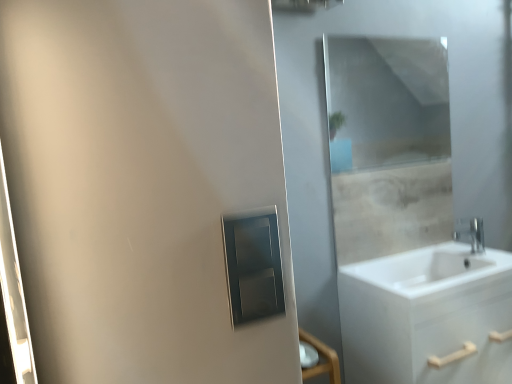
Question: Does silver metallic faucet at right have a larger size compared to matte silver medicine cabinet at center?

Choices:
 (A) yes
 (B) no

Answer: (A)

Question: From a real-world perspective, is silver metallic faucet at right positioned over matte silver medicine cabinet at center based on gravity?

Choices:
 (A) no
 (B) yes

Answer: (A)

Question: Does silver metallic faucet at right have a lesser width compared to matte silver medicine cabinet at center?

Choices:
 (A) yes
 (B) no

Answer: (B)

Question: From a real-world perspective, is silver metallic faucet at right beneath matte silver medicine cabinet at center?

Choices:
 (A) yes
 (B) no

Answer: (A)

Question: Considering the relative sizes of silver metallic faucet at right and matte silver medicine cabinet at center in the image provided, is silver metallic faucet at right shorter than matte silver medicine cabinet at center?

Choices:
 (A) yes
 (B) no

Answer: (A)

Question: Is white matte cabinet at lower right bigger or smaller than clear glass mirror at upper center?

Choices:
 (A) big
 (B) small

Answer: (A)

Question: Is point (387, 299) positioned closer to the camera than point (330, 39)?

Choices:
 (A) farther
 (B) closer

Answer: (B)

Question: Is white matte cabinet at lower right to the left or to the right of clear glass mirror at upper center in the image?

Choices:
 (A) right
 (B) left

Answer: (A)

Question: Relative to clear glass mirror at upper center, is white matte cabinet at lower right in front or behind?

Choices:
 (A) front
 (B) behind

Answer: (A)

Question: Does point (459, 238) appear closer or farther from the camera than point (342, 44)?

Choices:
 (A) closer
 (B) farther

Answer: (A)

Question: Considering their positions, is silver metallic faucet at right located in front of or behind clear glass mirror at upper center?

Choices:
 (A) front
 (B) behind

Answer: (B)

Question: From the image's perspective, relative to clear glass mirror at upper center, is silver metallic faucet at right above or below?

Choices:
 (A) below
 (B) above

Answer: (A)

Question: From a real-world perspective, relative to clear glass mirror at upper center, is silver metallic faucet at right vertically above or below?

Choices:
 (A) below
 (B) above

Answer: (A)

Question: From a real-world perspective, is matte silver medicine cabinet at center physically located above or below white matte cabinet at lower right?

Choices:
 (A) above
 (B) below

Answer: (A)

Question: In terms of size, does matte silver medicine cabinet at center appear bigger or smaller than white matte cabinet at lower right?

Choices:
 (A) big
 (B) small

Answer: (B)